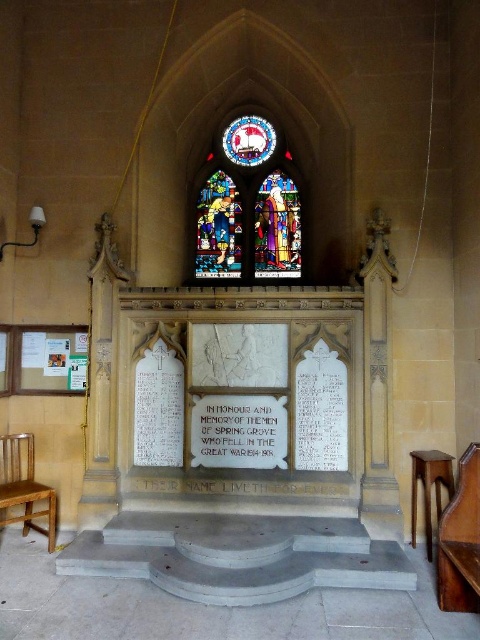
Which of these two, stained glass window at center or wooden chair at left, stands shorter?

With less height is wooden chair at left.

Is stained glass window at center shorter than wooden chair at left?

In fact, stained glass window at center may be taller than wooden chair at left.

Between point (199, 202) and point (31, 500), which one is positioned behind?

The point (199, 202) is behind.

At what (x,y) coordinates should I click in order to perform the action: click on stained glass window at center. Please return your answer as a coordinate pair (x, y). Image resolution: width=480 pixels, height=640 pixels. Looking at the image, I should click on (249, 208).

Is white paper at center to the right of wooden chair at left from the viewer's perspective?

Correct, you'll find white paper at center to the right of wooden chair at left.

Is white paper at center below wooden chair at left?

Incorrect, white paper at center is not positioned below wooden chair at left.

Where is `white paper at center`? The width and height of the screenshot is (480, 640). white paper at center is located at coordinates (239, 432).

Locate an element on the screen. This screenshot has width=480, height=640. white paper at center is located at coordinates (239, 432).

Is stained glass window at center positioned behind white paper at center?

That is True.

Is point (274, 259) more distant than point (260, 428)?

Yes, it is behind point (260, 428).

I want to click on stained glass window at center, so click(249, 208).